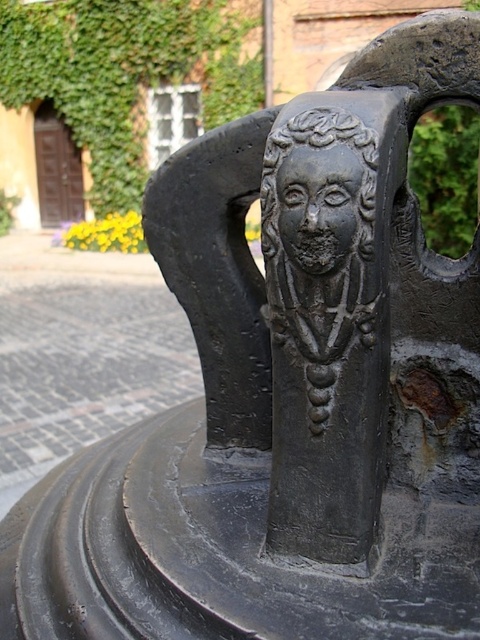
You are a painter standing 3 meters away from the black matte deity at center. You want to paint the green ivy at upper left without moving. Can you reach it with your 5 meter long paintbrush?

The distance between the black matte deity at center and green ivy at upper left is 6.08 meters. Since you are 3 meters away from the deity, the ivy is 3.08 meters away from you. Your paintbrush is 5 meters long, so yes, you can reach the green ivy at upper left.

You are an artist examining the intricate details of the matte black head at center and the black stone face at center. Which object is located to the left in the image?

The matte black head at center is positioned on the left side of black stone face at center.

You are an artist sketching the scene from the image. You want to draw the green ivy at upper left and the black stone face at center first. Which object should you draw first to maintain the correct spatial relationship?

You should draw the green ivy at upper left first because it is closer to the viewer than the black stone face at center, so it should be placed in front.